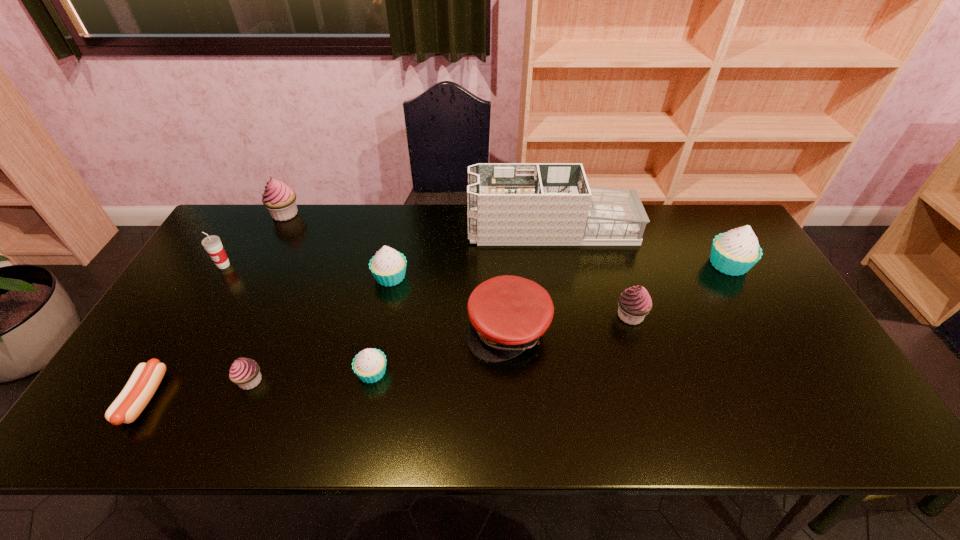
Locate an element on the screen. pink cupcake that is the second closest to the red cup is located at coordinates (245, 372).

Locate an element on the screen. The height and width of the screenshot is (540, 960). the third closest pink cupcake relative to the shortest object is located at coordinates (635, 303).

Point out which white cupcake is positioned as the second nearest to the second biggest white cupcake. Please provide its 2D coordinates. Your answer should be formatted as a tuple, i.e. [(x, y)], where the tuple contains the x and y coordinates of a point satisfying the conditions above.

[(735, 252)]

Identify which white cupcake is the nearest to the brown sausage. Please provide its 2D coordinates. Your answer should be formatted as a tuple, i.e. [(x, y)], where the tuple contains the x and y coordinates of a point satisfying the conditions above.

[(369, 365)]

Locate an element on the screen. The width and height of the screenshot is (960, 540). free location that satisfies the following two spatial constraints: 1. on the front side of the fifth cupcake from right to left; 2. on the right side of the leftmost pink cupcake is located at coordinates (200, 381).